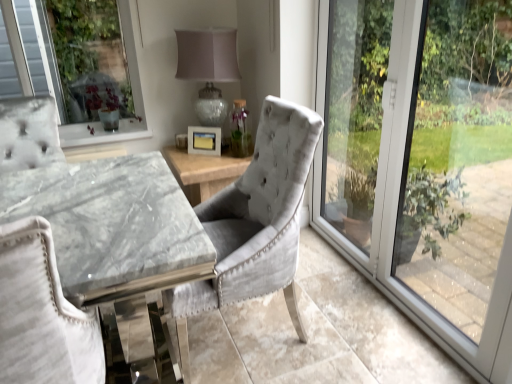
Question: From the image's perspective, is transparent glass window at right over white matte picture frame at center?

Choices:
 (A) yes
 (B) no

Answer: (B)

Question: Is transparent glass window at right wider than white matte picture frame at center?

Choices:
 (A) yes
 (B) no

Answer: (A)

Question: Considering the relative positions of transparent glass window at right and white matte picture frame at center in the image provided, is transparent glass window at right to the right of white matte picture frame at center from the viewer's perspective?

Choices:
 (A) yes
 (B) no

Answer: (A)

Question: Is transparent glass window at right taller than white matte picture frame at center?

Choices:
 (A) yes
 (B) no

Answer: (A)

Question: From a real-world perspective, is transparent glass window at right over white matte picture frame at center?

Choices:
 (A) no
 (B) yes

Answer: (B)

Question: Would you say white matte picture frame at center is part of transparent glass window at right's contents?

Choices:
 (A) no
 (B) yes

Answer: (A)

Question: Does matte glass table lamp at center have a greater width compared to white matte picture frame at center?

Choices:
 (A) yes
 (B) no

Answer: (A)

Question: Does matte glass table lamp at center touch white matte picture frame at center?

Choices:
 (A) yes
 (B) no

Answer: (B)

Question: Is matte glass table lamp at center outside of white matte picture frame at center?

Choices:
 (A) yes
 (B) no

Answer: (A)

Question: Is matte glass table lamp at center thinner than white matte picture frame at center?

Choices:
 (A) yes
 (B) no

Answer: (B)

Question: Could you tell me if matte glass table lamp at center is turned towards white matte picture frame at center?

Choices:
 (A) yes
 (B) no

Answer: (A)

Question: Can you confirm if matte glass table lamp at center is bigger than white matte picture frame at center?

Choices:
 (A) no
 (B) yes

Answer: (B)

Question: Does velvet grey chair at center, placed as the 2th chair when sorted from left to right, appear on the right side of matte glass table lamp at center?

Choices:
 (A) no
 (B) yes

Answer: (B)